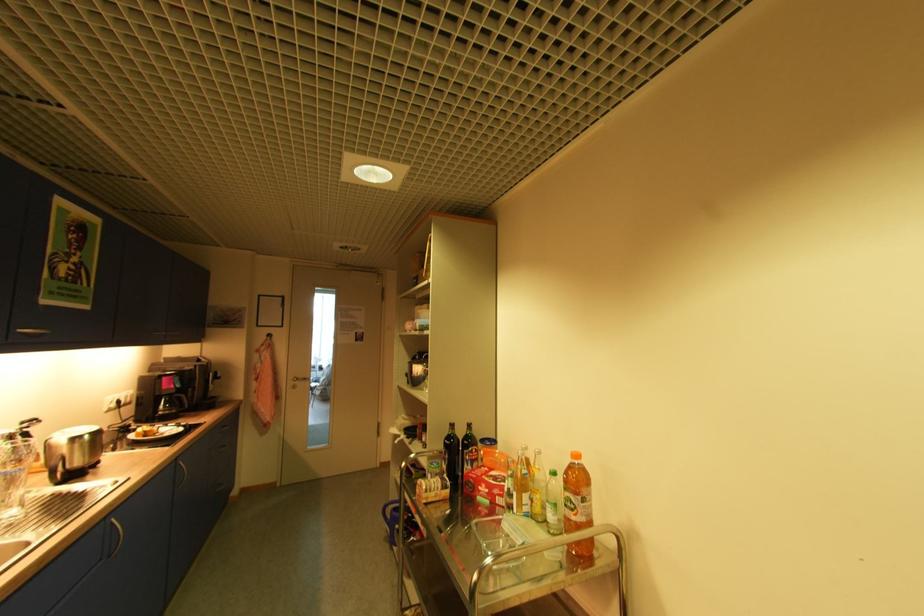
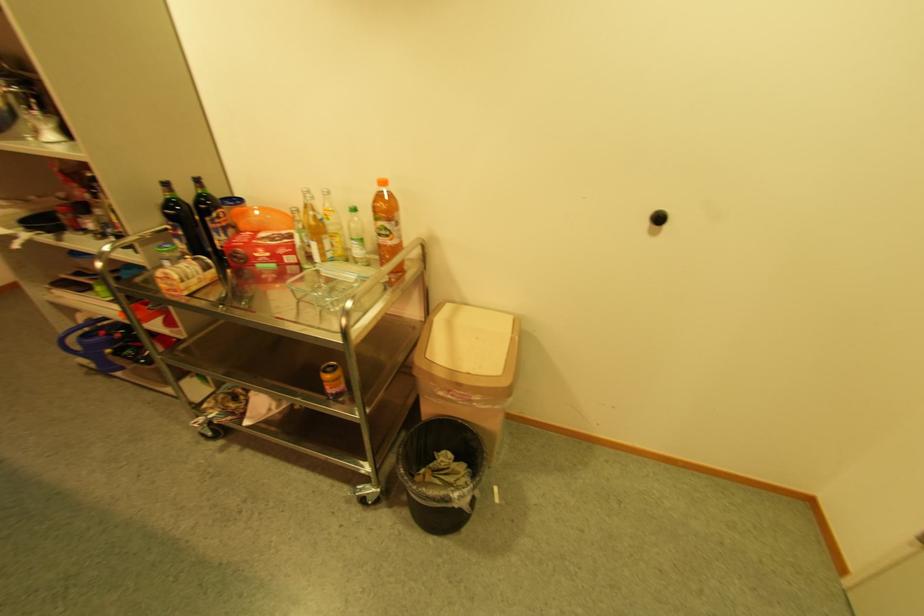
Find the pixel in the second image that matches [555,511] in the first image.

(363, 246)